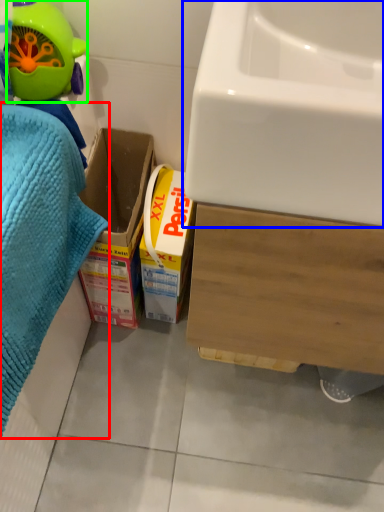
Question: Based on their relative distances, which object is farther from bath towel (highlighted by a red box)? Choose from sink (highlighted by a blue box) and toy (highlighted by a green box).

Choices:
 (A) sink
 (B) toy

Answer: (A)